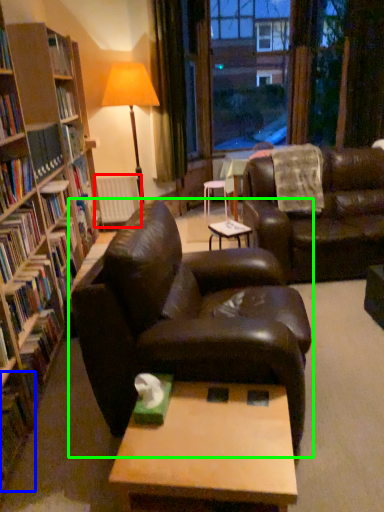
Question: Which object is the farthest from radiator (highlighted by a red box)? Choose among these: book (highlighted by a blue box) or studio couch (highlighted by a green box).

Choices:
 (A) book
 (B) studio couch

Answer: (A)